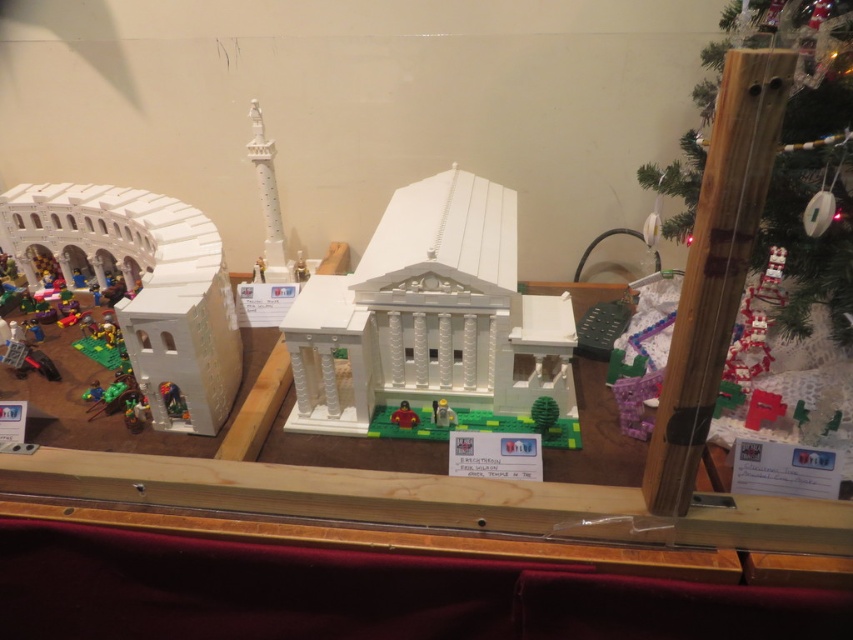
Is white lego amphitheater at left further to camera compared to matte white toy at center?

No.

Can you confirm if white lego amphitheater at left is smaller than matte white toy at center?

No, white lego amphitheater at left is not smaller than matte white toy at center.

Is point (189, 330) closer to camera compared to point (839, 422)?

That is True.

The image size is (853, 640). I want to click on white lego amphitheater at left, so (x=143, y=285).

Where is `matte red cube at center-right`? matte red cube at center-right is located at coordinates (763, 408).

Does point (779, 406) come farther from viewer compared to point (403, 412)?

No, (779, 406) is closer to viewer.

Where is `matte red cube at center-right`? Image resolution: width=853 pixels, height=640 pixels. matte red cube at center-right is located at coordinates (763, 408).

The height and width of the screenshot is (640, 853). I want to click on matte red cube at center-right, so click(x=763, y=408).

From the picture: Can you confirm if matte red cube at center-right is smaller than matte white toy at center?

No, matte red cube at center-right is not smaller than matte white toy at center.

Which is below, matte red cube at center-right or matte white toy at center?

matte white toy at center is lower down.

Measure the distance between matte red cube at center-right and camera.

matte red cube at center-right is 3.69 feet away from camera.

Find the location of `matte red cube at center-right`. matte red cube at center-right is located at coordinates (763, 408).